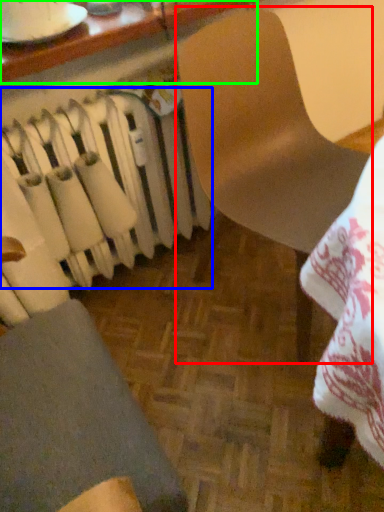
Question: Which is farther away from chair (highlighted by a red box)? radiator (highlighted by a blue box) or table (highlighted by a green box)?

Choices:
 (A) radiator
 (B) table

Answer: (B)